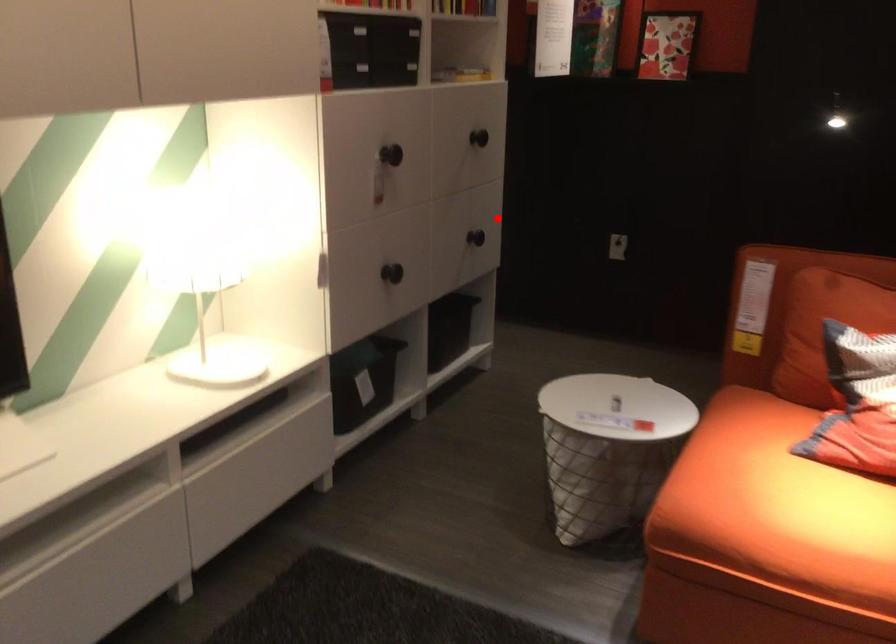
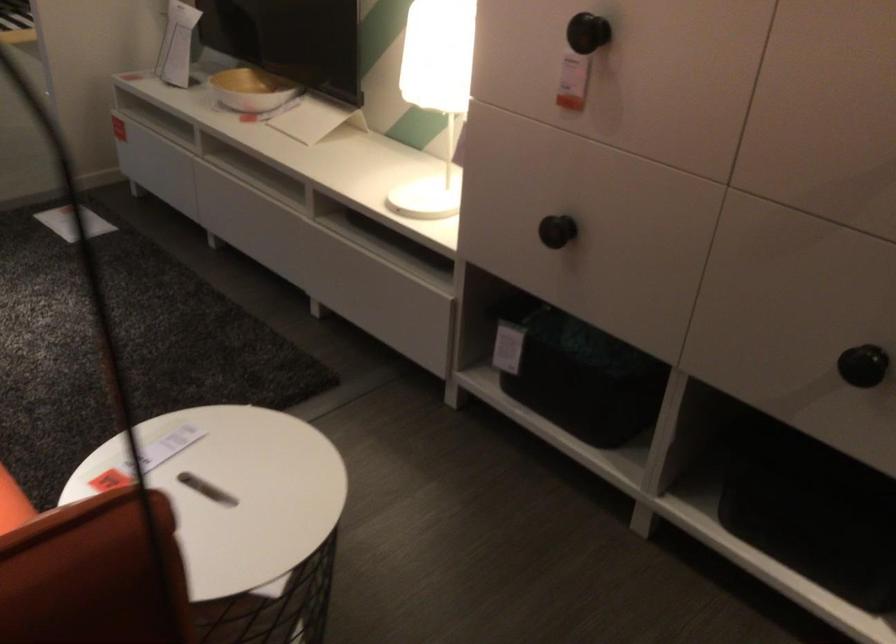
Question: I am providing you with two images of the same scene from different viewpoints. Image1 has a red point marked. In image2, the corresponding 3D location appears at what relative position? Reply with the corresponding letter.

Choices:
 (A) Closer
 (B) Farther

Answer: (A)